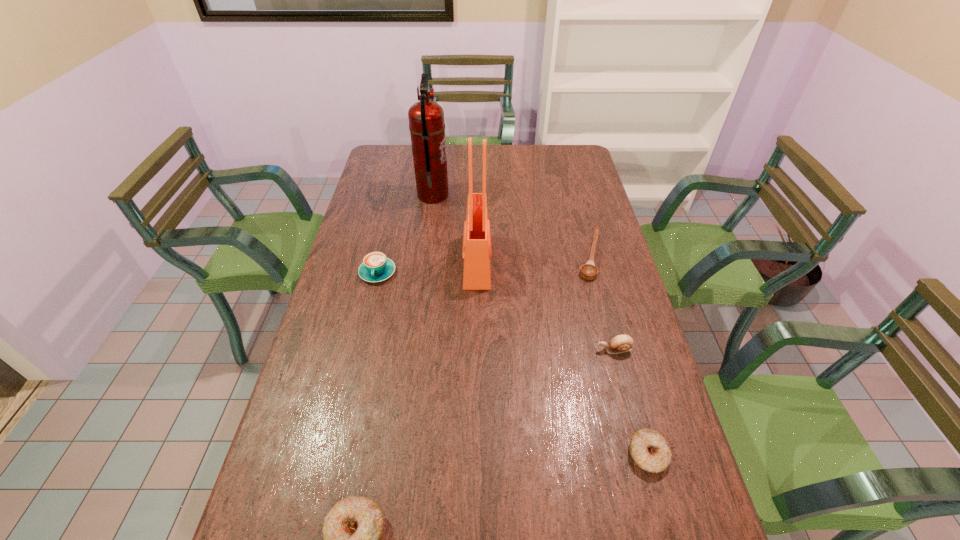
Identify the location of vacant space at the near edge. (463, 531).

The height and width of the screenshot is (540, 960). In order to click on vacant area at the left edge of the desktop in this screenshot , I will do `click(362, 305)`.

This screenshot has width=960, height=540. In the image, there is a desktop. Identify the location of free space at the right edge. (660, 395).

In the image, there is a desktop. Identify the location of blank space at the far right corner. The width and height of the screenshot is (960, 540). (567, 150).

You are a GUI agent. You are given a task and a screenshot of the screen. Output one action in this format:
    pyautogui.click(x=<x>, y=<y>)
    Task: Click on the vacant space at the near right corner of the desktop
    The height and width of the screenshot is (540, 960).
    Given the screenshot: What is the action you would take?
    pyautogui.click(x=640, y=535)

Identify the location of vacant space that's between the fifth farthest object and the shortest object. The height and width of the screenshot is (540, 960). (602, 303).

Identify the location of free point between the tote bag and the fire extinguisher. (455, 228).

Find the location of `empty space that is in between the tote bag and the right doughnut`. empty space that is in between the tote bag and the right doughnut is located at coordinates click(x=563, y=357).

Where is `vacant area between the escargot and the fire extinguisher`? The height and width of the screenshot is (540, 960). vacant area between the escargot and the fire extinguisher is located at coordinates (523, 273).

Point out which object is positioned as the sixth nearest to the third nearest object. Please provide its 2D coordinates. Your answer should be formatted as a tuple, i.e. [(x, y)], where the tuple contains the x and y coordinates of a point satisfying the conditions above.

[(426, 118)]